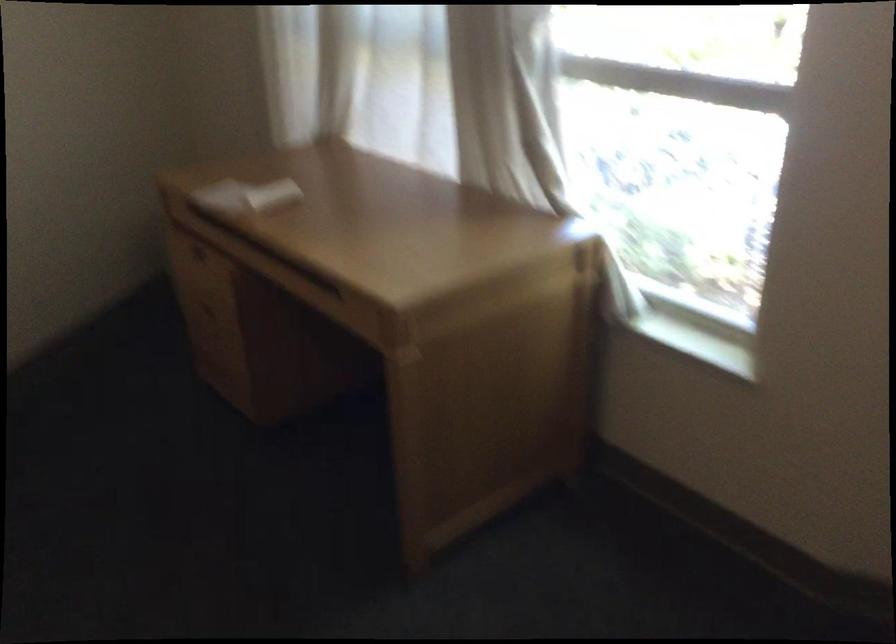
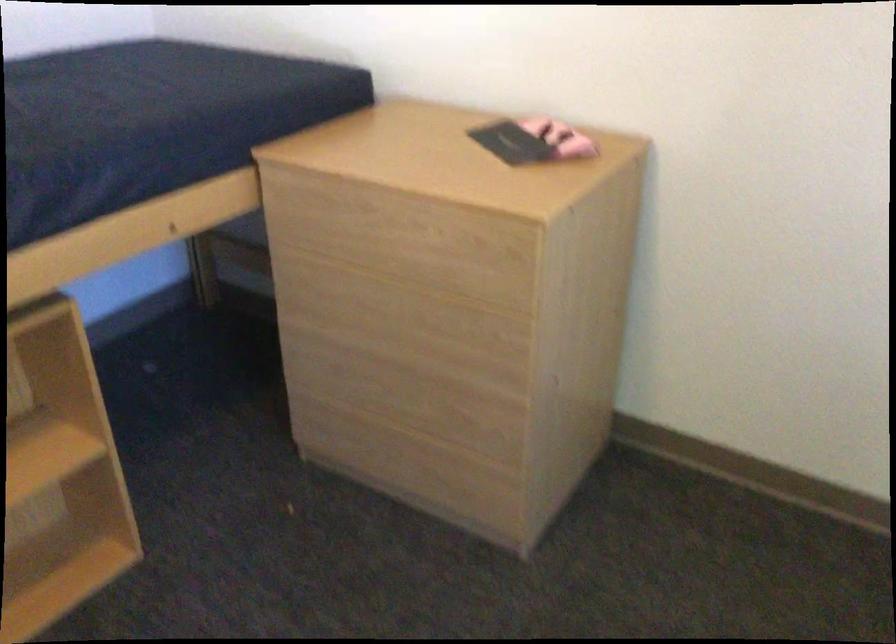
The images are taken continuously from a first-person perspective. In which direction is your viewpoint rotating?

The rotation direction of the camera is left-down.